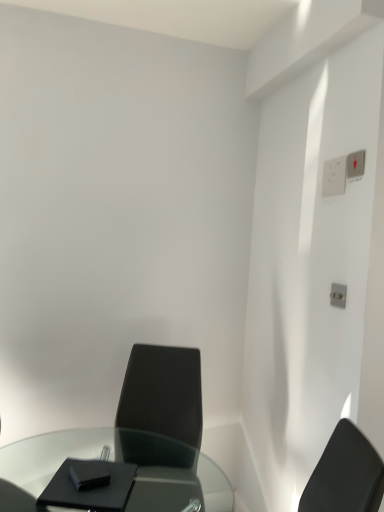
Question: From a real-world perspective, is white plastic electric outlet at upper right, the 2th electric outlet in the front-to-back sequence, physically located above or below matte black chair at center?

Choices:
 (A) above
 (B) below

Answer: (A)

Question: From the image's perspective, is white plastic electric outlet at upper right, the 2th electric outlet in the front-to-back sequence, located above or below matte black chair at center?

Choices:
 (A) above
 (B) below

Answer: (A)

Question: Estimate the real-world distances between objects in this image. Which object is farther from the transparent glass table at lower left?

Choices:
 (A) matte black chair at center
 (B) white plastic electric outlet at upper right, the 1th electric outlet in the back-to-front sequence
 (C) white plastic switch at upper right, the 2th electric outlet positioned from the back

Answer: (C)

Question: Based on their relative distances, which object is farther from the transparent glass table at lower left?

Choices:
 (A) white plastic switch at upper right, the 2th electric outlet positioned from the back
 (B) matte black chair at center
 (C) white plastic electric outlet at upper right, the 2th electric outlet in the front-to-back sequence

Answer: (A)